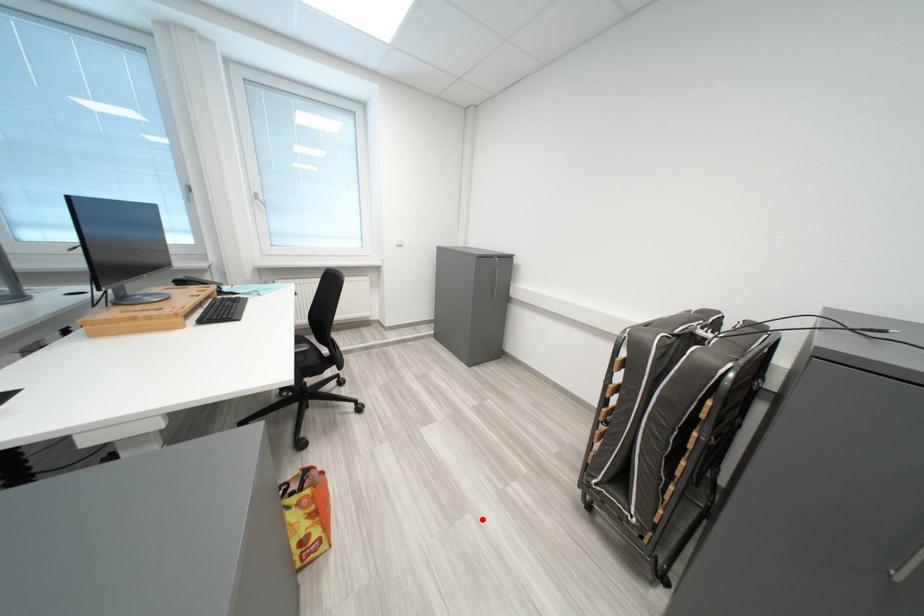
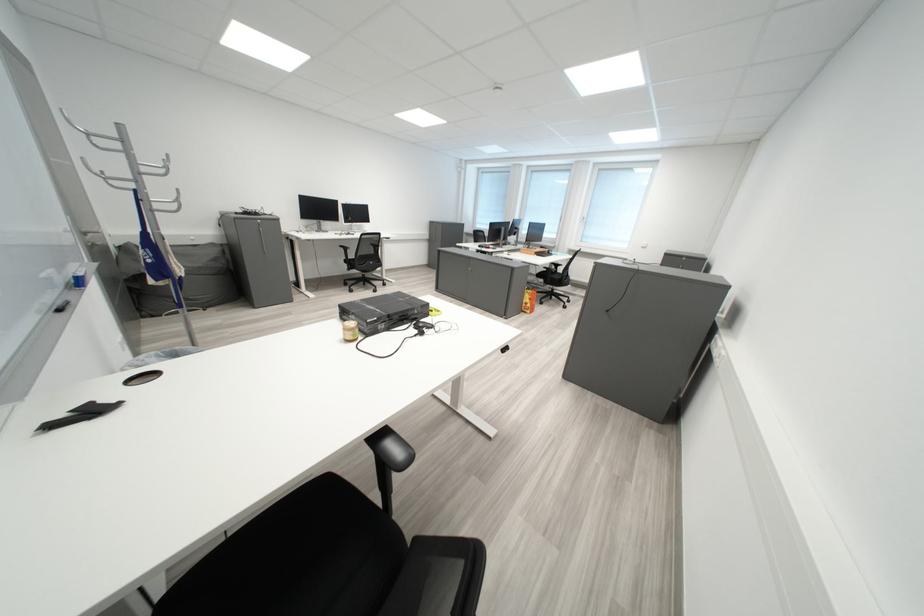
Question: I am providing you with two images of the same scene from different viewpoints. A red point is marked on the first image. Is the red point's position out of view in image 2?

Choices:
 (A) Yes
 (B) No

Answer: (B)